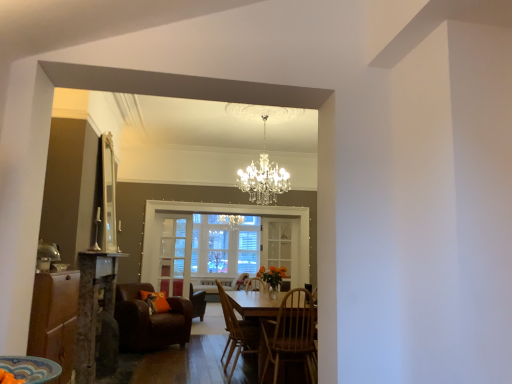
Question: Is the surface of clear glass window at center in direct contact with wooden chair at center, which is the second chair from front to back?

Choices:
 (A) yes
 (B) no

Answer: (B)

Question: From a real-world perspective, is clear glass window at center below wooden chair at center, the 3th chair from the back?

Choices:
 (A) no
 (B) yes

Answer: (A)

Question: Is clear glass window at center at the right side of wooden chair at center, the 3th chair from the back?

Choices:
 (A) no
 (B) yes

Answer: (A)

Question: Is clear glass window at center bigger than wooden chair at center, the 3th chair from the back?

Choices:
 (A) no
 (B) yes

Answer: (B)

Question: Does clear glass window at center have a lesser height compared to wooden chair at center, the 3th chair from the back?

Choices:
 (A) no
 (B) yes

Answer: (A)

Question: Would you say wooden cabinet at lower left is inside or outside clear glass window at center?

Choices:
 (A) inside
 (B) outside

Answer: (B)

Question: In the image, is wooden cabinet at lower left positioned in front of or behind clear glass window at center?

Choices:
 (A) behind
 (B) front

Answer: (B)

Question: From a real-world perspective, is wooden cabinet at lower left positioned above or below clear glass window at center?

Choices:
 (A) below
 (B) above

Answer: (A)

Question: Considering the positions of wooden cabinet at lower left and clear glass window at center in the image, is wooden cabinet at lower left taller or shorter than clear glass window at center?

Choices:
 (A) short
 (B) tall

Answer: (A)

Question: Is clear glass door at center, the second glass door from the front, inside or outside of clear glass door at center, placed as the second glass door when sorted from back to front?

Choices:
 (A) inside
 (B) outside

Answer: (B)

Question: Does point coord(297,244) appear closer or farther from the camera than point coord(165,240)?

Choices:
 (A) closer
 (B) farther

Answer: (B)

Question: Looking at their shapes, would you say clear glass door at center, which appears as the first glass door when viewed from the right, is wider or thinner than clear glass door at center, the 1th glass door when ordered from left to right?

Choices:
 (A) wide
 (B) thin

Answer: (A)

Question: Considering the positions of clear glass door at center, placed as the 2th glass door when sorted from left to right, and clear glass door at center, the first glass door from the front, in the image, is clear glass door at center, placed as the 2th glass door when sorted from left to right, bigger or smaller than clear glass door at center, the first glass door from the front,?

Choices:
 (A) small
 (B) big

Answer: (A)

Question: Considering the positions of point (280, 349) and point (34, 342), is point (280, 349) closer or farther from the camera than point (34, 342)?

Choices:
 (A) closer
 (B) farther

Answer: (B)

Question: Considering the positions of wooden chair at center, which ranks as the first chair in front-to-back order, and wooden cabinet at lower left in the image, is wooden chair at center, which ranks as the first chair in front-to-back order, taller or shorter than wooden cabinet at lower left?

Choices:
 (A) tall
 (B) short

Answer: (A)